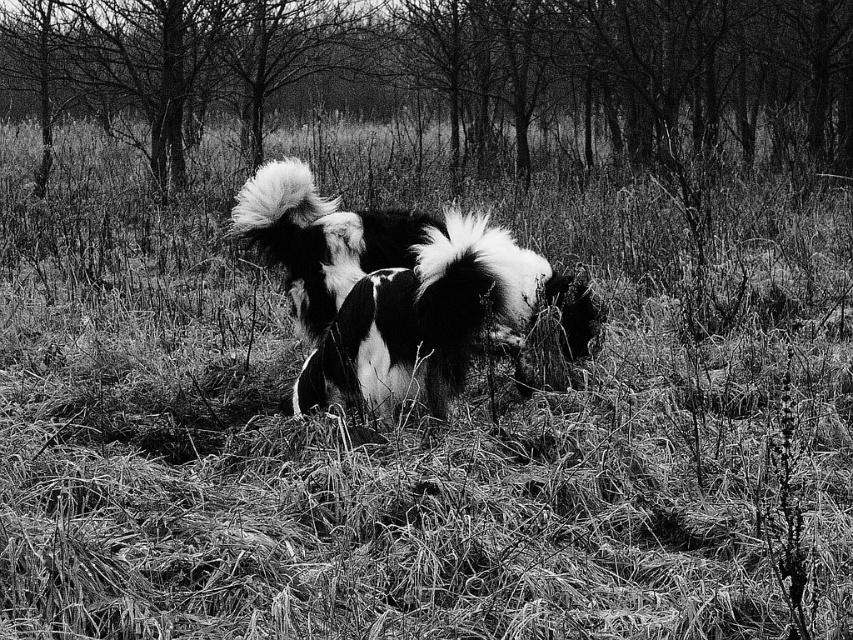
Question: Considering the relative positions of smooth bark tree at center and black and white fur dog at center in the image provided, where is smooth bark tree at center located with respect to black and white fur dog at center?

Choices:
 (A) left
 (B) right

Answer: (A)

Question: Among these objects, which one is farthest from the camera?

Choices:
 (A) black and white fur dog at center
 (B) smooth bark tree at center

Answer: (B)

Question: Can you confirm if smooth bark tree at center is thinner than black and white fur dog at center?

Choices:
 (A) yes
 (B) no

Answer: (B)

Question: In this image, where is smooth bark tree at center located relative to black and white fur dog at center?

Choices:
 (A) above
 (B) below

Answer: (A)

Question: Which point is closer to the camera?

Choices:
 (A) smooth bark tree at center
 (B) black and white fur dog at center

Answer: (B)

Question: Which of the following is the closest to the observer?

Choices:
 (A) black and white fur dog at center
 (B) smooth bark tree at center

Answer: (A)